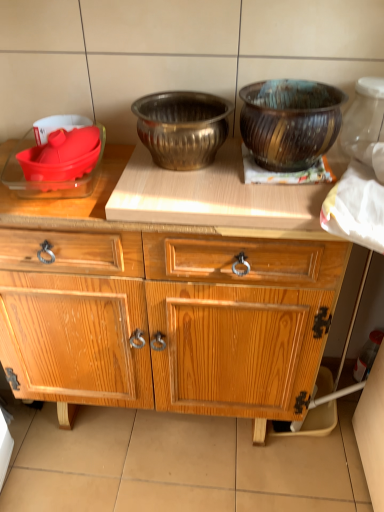
Looking at this image, how much space does matte red bowl at left, marked as the second bowl in a left-to-right arrangement, occupy vertically?

matte red bowl at left, marked as the second bowl in a left-to-right arrangement, is 3.69 inches tall.

The height and width of the screenshot is (512, 384). Describe the element at coordinates (57, 125) in the screenshot. I see `matte red bowl at upper left, the first bowl viewed from the left` at that location.

What is the approximate height of translucent glass jar at upper right?

It is 6.83 inches.

You are a GUI agent. You are given a task and a screenshot of the screen. Output one action in this format:
    pyautogui.click(x=<x>, y=<y>)
    Task: Click on the brushed metal bowl at center, the second bowl from the right
    This screenshot has height=512, width=384.
    Given the screenshot: What is the action you would take?
    pyautogui.click(x=182, y=127)

Where is `matte red bowl at left, marked as the second bowl in a left-to-right arrangement`? matte red bowl at left, marked as the second bowl in a left-to-right arrangement is located at coordinates (62, 155).

Is translucent glass jar at upper right aimed at wooden textured bowl at upper right, which appears as the first bowl when viewed from the right?

No, translucent glass jar at upper right is not oriented towards wooden textured bowl at upper right, which appears as the first bowl when viewed from the right.

Based on their positions, is translucent glass jar at upper right located to the left or right of wooden textured bowl at upper right, which appears as the first bowl when viewed from the right?

From the image, it's evident that translucent glass jar at upper right is to the right of wooden textured bowl at upper right, which appears as the first bowl when viewed from the right.

Between translucent glass jar at upper right and wooden textured bowl at upper right, which appears as the first bowl when viewed from the right, which one has more height?

translucent glass jar at upper right.

Is translucent glass jar at upper right wider than wooden textured bowl at upper right, which appears as the first bowl when viewed from the right?

In fact, translucent glass jar at upper right might be narrower than wooden textured bowl at upper right, which appears as the first bowl when viewed from the right.

Is point (36, 152) more distant than point (361, 128)?

No, (36, 152) is in front of (361, 128).

From the image's perspective, who appears lower, matte red bowl at left, marked as the second bowl in a left-to-right arrangement, or translucent glass jar at upper right?

matte red bowl at left, marked as the second bowl in a left-to-right arrangement, is shown below in the image.

Would you say matte red bowl at left, placed as the third bowl when sorted from right to left, contains translucent glass jar at upper right?

No, matte red bowl at left, placed as the third bowl when sorted from right to left, does not contain translucent glass jar at upper right.

Considering the relative positions of translucent glass jar at upper right and wooden cabinet at center in the image provided, is translucent glass jar at upper right to the left of wooden cabinet at center from the viewer's perspective?

Incorrect, translucent glass jar at upper right is not on the left side of wooden cabinet at center.

How much distance is there between translucent glass jar at upper right and wooden cabinet at center?

22.52 inches.

Is wooden cabinet at center inside translucent glass jar at upper right?

No, wooden cabinet at center is not surrounded by translucent glass jar at upper right.

Considering the relative sizes of translucent glass jar at upper right and wooden cabinet at center in the image provided, is translucent glass jar at upper right bigger than wooden cabinet at center?

Actually, translucent glass jar at upper right might be smaller than wooden cabinet at center.

Is the surface of translucent glass jar at upper right in direct contact with matte red bowl at upper left, the first bowl viewed from the left?

No, translucent glass jar at upper right is not in contact with matte red bowl at upper left, the first bowl viewed from the left.

From the image's perspective, is translucent glass jar at upper right over matte red bowl at upper left, the first bowl viewed from the left?

Yes, from the image's perspective, translucent glass jar at upper right is above matte red bowl at upper left, the first bowl viewed from the left.

I want to click on the 4th bowl to the left when counting from the translucent glass jar at upper right, so click(x=57, y=125).

Would you say translucent glass jar at upper right is outside matte red bowl at upper left, the first bowl viewed from the left?

Indeed, translucent glass jar at upper right is completely outside matte red bowl at upper left, the first bowl viewed from the left.

Considering the relative sizes of wooden textured bowl at upper right, the fourth bowl in the left-to-right sequence, and matte red bowl at upper left, the first bowl viewed from the left, in the image provided, is wooden textured bowl at upper right, the fourth bowl in the left-to-right sequence, shorter than matte red bowl at upper left, the first bowl viewed from the left,?

No.

In the image, is wooden textured bowl at upper right, the fourth bowl in the left-to-right sequence, positioned in front of or behind matte red bowl at upper left, the first bowl viewed from the left?

Visually, wooden textured bowl at upper right, the fourth bowl in the left-to-right sequence, is located in front of matte red bowl at upper left, the first bowl viewed from the left.

From the image's perspective, which one is positioned lower, wooden textured bowl at upper right, the fourth bowl in the left-to-right sequence, or matte red bowl at upper left, the first bowl viewed from the left?

wooden textured bowl at upper right, the fourth bowl in the left-to-right sequence.

From a real-world perspective, is wooden textured bowl at upper right, the fourth bowl in the left-to-right sequence, on top of matte red bowl at upper left, which is counted as the fourth bowl, starting from the right?

Yes, from a real-world perspective, wooden textured bowl at upper right, the fourth bowl in the left-to-right sequence, is above matte red bowl at upper left, which is counted as the fourth bowl, starting from the right.

This screenshot has height=512, width=384. In order to click on the 2nd bowl positioned below the translucent glass jar at upper right (from the image's perspective) in this screenshot , I will do `click(182, 127)`.

Which is more distant, (x=363, y=123) or (x=147, y=102)?

The point (x=363, y=123) is farther from the camera.

Is translucent glass jar at upper right oriented towards brushed metal bowl at center, the second bowl from the right?

No, translucent glass jar at upper right is not turned towards brushed metal bowl at center, the second bowl from the right.

Choose the correct answer: Is translucent glass jar at upper right inside brushed metal bowl at center, the 3th bowl viewed from the left, or outside it?

The correct answer is: outside.

Considering the relative sizes of wooden cabinet at center and matte red bowl at upper left, the first bowl viewed from the left, in the image provided, is wooden cabinet at center thinner than matte red bowl at upper left, the first bowl viewed from the left,?

In fact, wooden cabinet at center might be wider than matte red bowl at upper left, the first bowl viewed from the left.

Measure the distance from wooden cabinet at center to matte red bowl at upper left, which is counted as the fourth bowl, starting from the right.

wooden cabinet at center is 19.44 inches away from matte red bowl at upper left, which is counted as the fourth bowl, starting from the right.

Between wooden cabinet at center and matte red bowl at upper left, which is counted as the fourth bowl, starting from the right, which one has larger size?

With larger size is wooden cabinet at center.

From the picture: Can you confirm if wooden cabinet at center is positioned to the right of matte red bowl at upper left, which is counted as the fourth bowl, starting from the right?

Indeed, wooden cabinet at center is positioned on the right side of matte red bowl at upper left, which is counted as the fourth bowl, starting from the right.

I want to click on pottery to the right of wooden textured bowl at upper right, which appears as the first bowl when viewed from the right, so click(x=364, y=120).

This screenshot has width=384, height=512. What are the coordinates of `pottery above the matte red bowl at left, placed as the third bowl when sorted from right to left (from the image's perspective)` in the screenshot? It's located at (364, 120).

From the image, which object appears to be farther from wooden cabinet at center, brushed metal bowl at center, the second bowl from the right, or matte red bowl at left, marked as the second bowl in a left-to-right arrangement?

matte red bowl at left, marked as the second bowl in a left-to-right arrangement, lies further to wooden cabinet at center than the other object.

Considering their positions, is matte red bowl at left, placed as the third bowl when sorted from right to left, positioned further to brushed metal bowl at center, the 3th bowl viewed from the left, than wooden textured bowl at upper right, the fourth bowl in the left-to-right sequence?

Based on the image, matte red bowl at left, placed as the third bowl when sorted from right to left, appears to be further to brushed metal bowl at center, the 3th bowl viewed from the left.

Consider the image. Estimate the real-world distances between objects in this image. Which object is closer to brushed metal bowl at center, the 3th bowl viewed from the left, translucent glass jar at upper right or wooden textured bowl at upper right, the fourth bowl in the left-to-right sequence?

Based on the image, wooden textured bowl at upper right, the fourth bowl in the left-to-right sequence, appears to be nearer to brushed metal bowl at center, the 3th bowl viewed from the left.

Based on their spatial positions, is wooden cabinet at center or matte red bowl at left, placed as the third bowl when sorted from right to left, further from translucent glass jar at upper right?

matte red bowl at left, placed as the third bowl when sorted from right to left, is further to translucent glass jar at upper right.

Based on their spatial positions, is wooden textured bowl at upper right, which appears as the first bowl when viewed from the right, or wooden cabinet at center closer to translucent glass jar at upper right?

Based on the image, wooden textured bowl at upper right, which appears as the first bowl when viewed from the right, appears to be nearer to translucent glass jar at upper right.

Considering their positions, is matte red bowl at left, marked as the second bowl in a left-to-right arrangement, positioned further to wooden textured bowl at upper right, which appears as the first bowl when viewed from the right, than matte red bowl at upper left, which is counted as the fourth bowl, starting from the right?

matte red bowl at upper left, which is counted as the fourth bowl, starting from the right, lies further to wooden textured bowl at upper right, which appears as the first bowl when viewed from the right, than the other object.

Considering their positions, is matte red bowl at upper left, which is counted as the fourth bowl, starting from the right, positioned closer to brushed metal bowl at center, the second bowl from the right, than wooden textured bowl at upper right, which appears as the first bowl when viewed from the right?

Among the two, wooden textured bowl at upper right, which appears as the first bowl when viewed from the right, is located nearer to brushed metal bowl at center, the second bowl from the right.

Estimate the real-world distances between objects in this image. Which object is further from matte red bowl at upper left, the first bowl viewed from the left, wooden textured bowl at upper right, which appears as the first bowl when viewed from the right, or translucent glass jar at upper right?

translucent glass jar at upper right lies further to matte red bowl at upper left, the first bowl viewed from the left, than the other object.

This screenshot has width=384, height=512. I want to click on bowl between matte red bowl at upper left, which is counted as the fourth bowl, starting from the right, and brushed metal bowl at center, the second bowl from the right, in the horizontal direction, so (x=62, y=155).

In order to click on cabinetry between matte red bowl at left, placed as the third bowl when sorted from right to left, and translucent glass jar at upper right from left to right in this screenshot , I will do `click(179, 316)`.

This screenshot has height=512, width=384. Identify the location of bowl between brushed metal bowl at center, the 3th bowl viewed from the left, and translucent glass jar at upper right. (290, 122).

Find the location of a particular element. cabinetry between matte red bowl at left, marked as the second bowl in a left-to-right arrangement, and wooden textured bowl at upper right, which appears as the first bowl when viewed from the right, from left to right is located at coordinates (179, 316).